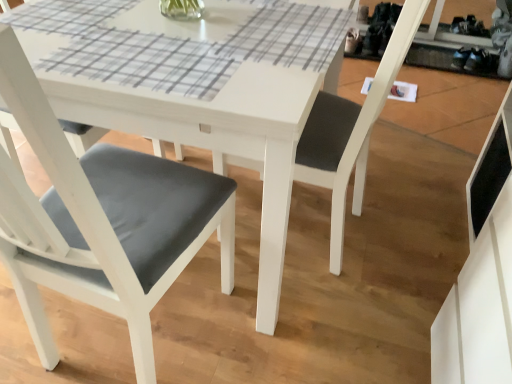
Image resolution: width=512 pixels, height=384 pixels. I want to click on matte gray cushion at lower left, placed as the first chair when sorted from left to right, so click(x=101, y=220).

What do you see at coordinates (101, 220) in the screenshot? I see `matte gray cushion at lower left, which appears as the 2th chair when viewed from the right` at bounding box center [101, 220].

Measure the distance between matte gray cushion at lower left, placed as the first chair when sorted from left to right, and camera.

The distance of matte gray cushion at lower left, placed as the first chair when sorted from left to right, from camera is 17.40 inches.

What do you see at coordinates (351, 131) in the screenshot? The image size is (512, 384). I see `matte gray cushion at center, which is the 1th chair from right to left` at bounding box center [351, 131].

Identify the location of matte gray cushion at center, which is the 1th chair from right to left. Image resolution: width=512 pixels, height=384 pixels. (351, 131).

Where is `matte gray cushion at lower left, placed as the first chair when sorted from left to right`? The height and width of the screenshot is (384, 512). matte gray cushion at lower left, placed as the first chair when sorted from left to right is located at coordinates (101, 220).

Can you confirm if matte gray cushion at lower left, which appears as the 2th chair when viewed from the right, is positioned to the left of matte gray cushion at center, the second chair viewed from the left?

Indeed, matte gray cushion at lower left, which appears as the 2th chair when viewed from the right, is positioned on the left side of matte gray cushion at center, the second chair viewed from the left.

Which is in front, matte gray cushion at lower left, which appears as the 2th chair when viewed from the right, or matte gray cushion at center, which is the 1th chair from right to left?

matte gray cushion at lower left, which appears as the 2th chair when viewed from the right.

Which is more distant, (119, 244) or (305, 170)?

Positioned behind is point (305, 170).

From the image's perspective, is matte gray cushion at lower left, which appears as the 2th chair when viewed from the right, positioned above or below matte gray cushion at center, the second chair viewed from the left?

Based on their image positions, matte gray cushion at lower left, which appears as the 2th chair when viewed from the right, is located above matte gray cushion at center, the second chair viewed from the left.

From a real-world perspective, between matte gray cushion at lower left, which appears as the 2th chair when viewed from the right, and matte gray cushion at center, which is the 1th chair from right to left, who is vertically higher?

From a 3D spatial view, matte gray cushion at center, which is the 1th chair from right to left, is above.

Considering the sizes of objects matte gray cushion at lower left, which appears as the 2th chair when viewed from the right, and matte gray cushion at center, the second chair viewed from the left, in the image provided, who is thinner, matte gray cushion at lower left, which appears as the 2th chair when viewed from the right, or matte gray cushion at center, the second chair viewed from the left,?

Thinner between the two is matte gray cushion at center, the second chair viewed from the left.

Considering the sizes of objects matte gray cushion at lower left, placed as the first chair when sorted from left to right, and matte gray cushion at center, which is the 1th chair from right to left, in the image provided, who is taller, matte gray cushion at lower left, placed as the first chair when sorted from left to right, or matte gray cushion at center, which is the 1th chair from right to left,?

With more height is matte gray cushion at center, which is the 1th chair from right to left.

Looking at the image, does matte gray cushion at lower left, placed as the first chair when sorted from left to right, seem bigger or smaller compared to matte gray cushion at center, which is the 1th chair from right to left?

In the image, matte gray cushion at lower left, placed as the first chair when sorted from left to right, appears to be larger than matte gray cushion at center, which is the 1th chair from right to left.

Is matte gray cushion at center, the second chair viewed from the left, surrounded by matte gray cushion at lower left, placed as the first chair when sorted from left to right?

Yes, matte gray cushion at center, the second chair viewed from the left, is a part of matte gray cushion at lower left, placed as the first chair when sorted from left to right.

Is matte gray cushion at lower left, placed as the first chair when sorted from left to right, with matte gray cushion at center, the second chair viewed from the left?

No, matte gray cushion at lower left, placed as the first chair when sorted from left to right, is not with matte gray cushion at center, the second chair viewed from the left.

Could you tell me if matte gray cushion at lower left, which appears as the 2th chair when viewed from the right, is facing matte gray cushion at center, the second chair viewed from the left?

No, matte gray cushion at lower left, which appears as the 2th chair when viewed from the right, does not turn towards matte gray cushion at center, the second chair viewed from the left.

Can you tell me how much matte gray cushion at lower left, placed as the first chair when sorted from left to right, and matte gray cushion at center, which is the 1th chair from right to left, differ in facing direction?

The angular difference between matte gray cushion at lower left, placed as the first chair when sorted from left to right, and matte gray cushion at center, which is the 1th chair from right to left, is 5.62 degrees.

The image size is (512, 384). Identify the location of chair on the left of matte gray cushion at center, the second chair viewed from the left. (101, 220).

Can you confirm if matte gray cushion at center, which is the 1th chair from right to left, is positioned to the left of matte gray cushion at lower left, placed as the first chair when sorted from left to right?

No.

Which object is closer to the camera taking this photo, matte gray cushion at center, the second chair viewed from the left, or matte gray cushion at lower left, placed as the first chair when sorted from left to right?

matte gray cushion at lower left, placed as the first chair when sorted from left to right.

Does point (366, 108) come farther from viewer compared to point (25, 294)?

Yes, point (366, 108) is behind point (25, 294).

From the image's perspective, which is below, matte gray cushion at center, the second chair viewed from the left, or matte gray cushion at lower left, placed as the first chair when sorted from left to right?

matte gray cushion at center, the second chair viewed from the left, from the image's perspective.

From a real-world perspective, who is located higher, matte gray cushion at center, the second chair viewed from the left, or matte gray cushion at lower left, placed as the first chair when sorted from left to right?

matte gray cushion at center, the second chair viewed from the left, is physically above.

Is matte gray cushion at center, the second chair viewed from the left, wider or thinner than matte gray cushion at lower left, placed as the first chair when sorted from left to right?

matte gray cushion at center, the second chair viewed from the left, is thinner than matte gray cushion at lower left, placed as the first chair when sorted from left to right.

Between matte gray cushion at center, the second chair viewed from the left, and matte gray cushion at lower left, which appears as the 2th chair when viewed from the right, which one has less height?

Standing shorter between the two is matte gray cushion at lower left, which appears as the 2th chair when viewed from the right.

Considering the sizes of objects matte gray cushion at center, which is the 1th chair from right to left, and matte gray cushion at lower left, which appears as the 2th chair when viewed from the right, in the image provided, who is bigger, matte gray cushion at center, which is the 1th chair from right to left, or matte gray cushion at lower left, which appears as the 2th chair when viewed from the right,?

matte gray cushion at lower left, which appears as the 2th chair when viewed from the right, is bigger.

Would you say matte gray cushion at center, the second chair viewed from the left, is outside matte gray cushion at lower left, placed as the first chair when sorted from left to right?

No, matte gray cushion at center, the second chair viewed from the left, is inside matte gray cushion at lower left, placed as the first chair when sorted from left to right,'s boundary.

Is there a large distance between matte gray cushion at center, which is the 1th chair from right to left, and matte gray cushion at lower left, placed as the first chair when sorted from left to right?

No, matte gray cushion at center, which is the 1th chair from right to left, is not far away from matte gray cushion at lower left, placed as the first chair when sorted from left to right.

Could you tell me if matte gray cushion at center, which is the 1th chair from right to left, is facing matte gray cushion at lower left, placed as the first chair when sorted from left to right?

Yes, matte gray cushion at center, which is the 1th chair from right to left, is facing matte gray cushion at lower left, placed as the first chair when sorted from left to right.

How different are the orientations of matte gray cushion at center, the second chair viewed from the left, and matte gray cushion at lower left, placed as the first chair when sorted from left to right, in degrees?

5.62 degrees.

Find the location of `chair above the matte gray cushion at lower left, placed as the first chair when sorted from left to right (from a real-world perspective)`. chair above the matte gray cushion at lower left, placed as the first chair when sorted from left to right (from a real-world perspective) is located at coordinates [351, 131].

This screenshot has width=512, height=384. I want to click on chair below the matte gray cushion at lower left, placed as the first chair when sorted from left to right (from the image's perspective), so click(351, 131).

Locate an element on the screen. This screenshot has height=384, width=512. chair on the left of matte gray cushion at center, which is the 1th chair from right to left is located at coordinates (101, 220).